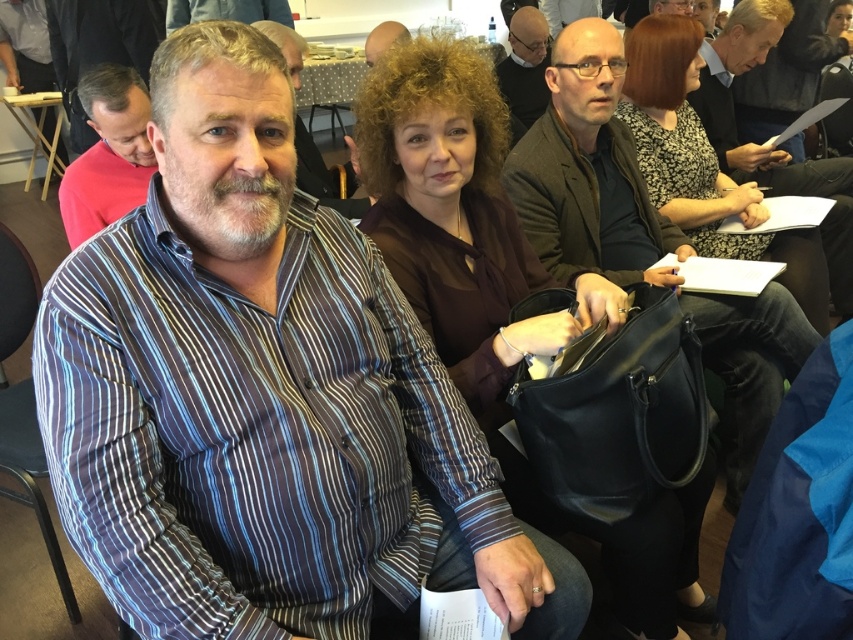
Who is lower down, brown leather handbag at center or floral-patterned fabric purse at center?

brown leather handbag at center

Does point (409, 161) lie in front of point (676, 113)?

That is True.

Where is `brown leather handbag at center`? brown leather handbag at center is located at coordinates click(498, 296).

Locate an element on the screen. This screenshot has height=640, width=853. striped cotton shirt at center is located at coordinates (264, 397).

Which is above, striped cotton shirt at center or brown leather handbag at center?

brown leather handbag at center is above.

You are a GUI agent. You are given a task and a screenshot of the screen. Output one action in this format:
    pyautogui.click(x=<x>, y=<y>)
    Task: Click on the striped cotton shirt at center
    The image size is (853, 640).
    Given the screenshot: What is the action you would take?
    pyautogui.click(x=264, y=397)

What do you see at coordinates (703, 163) in the screenshot? The width and height of the screenshot is (853, 640). I see `floral-patterned fabric purse at center` at bounding box center [703, 163].

In the scene shown: Can you confirm if floral-patterned fabric purse at center is positioned to the left of matte black shirt at center?

No, floral-patterned fabric purse at center is not to the left of matte black shirt at center.

Does point (802, 275) come behind point (518, 58)?

No, (802, 275) is closer to viewer.

Locate an element on the screen. Image resolution: width=853 pixels, height=640 pixels. floral-patterned fabric purse at center is located at coordinates (703, 163).